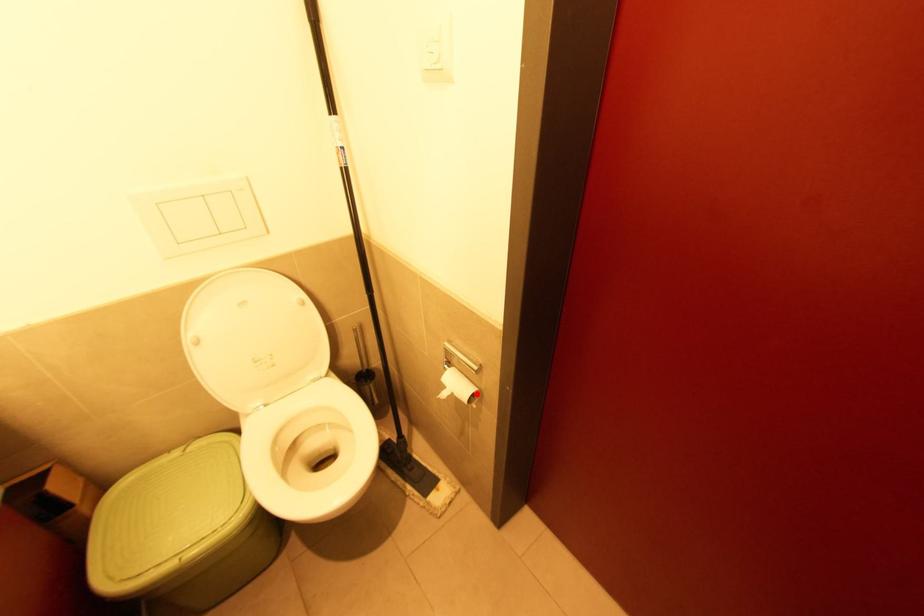
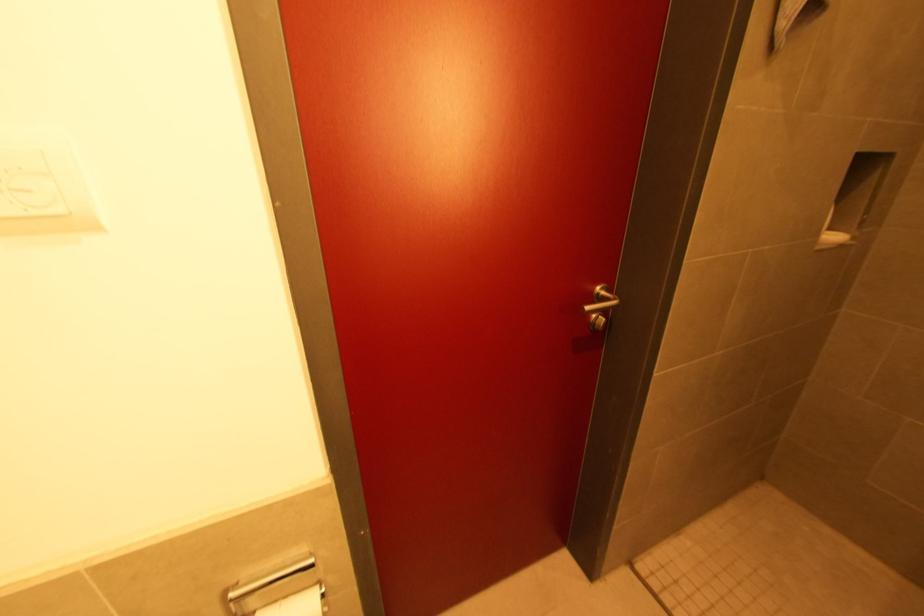
Locate, in the second image, the point that corresponds to the highlighted location in the first image.

(323, 591)